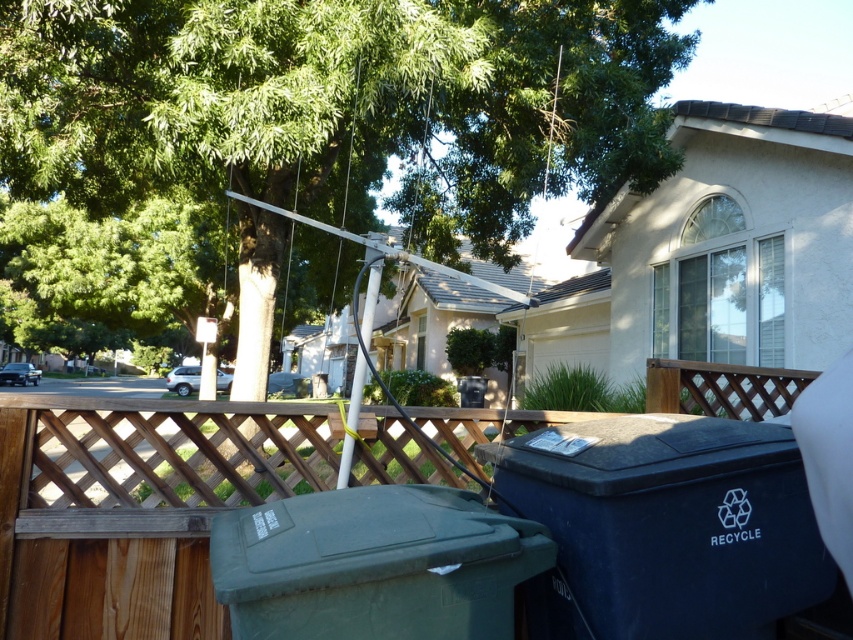
Based on the photo, you are standing on the wooden deck and want to place a plastic bottle into the correct bin. The recycling bin is located at coordinates point (665, 525). Which bin should you use?

The recycling bin at point (665, 525) is the correct bin for the plastic bottle since it is labeled for recyclable materials.

You are standing on the wooden deck and want to place a recyclable item into the matte black recycling bin at lower right. Considering your arm reaches 1.5 meters, can you reach the bin without moving closer?

Answer: The matte black recycling bin at lower right is 1.64 meters from viewer, which is beyond your arm reach of 1.5 meters. You need to move closer to reach it.

You are standing on the wooden deck and want to place a recyclable item into the green plastic recycling bin at lower center. However, there is a green leafy tree at upper left in your way. Can you still reach the bin without moving the tree?

The green leafy tree at upper left is further to the viewer than the green plastic recycling bin at lower center, so the tree is closer to you. This means the tree is blocking your direct path to the bin, making it unreachable without moving the tree.